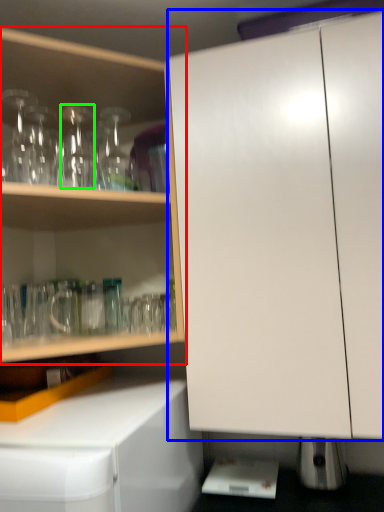
Question: Based on their relative distances, which object is farther from cabinetry (highlighted by a red box)? Choose from cabinetry (highlighted by a blue box) and bottle (highlighted by a green box).

Choices:
 (A) cabinetry
 (B) bottle

Answer: (A)